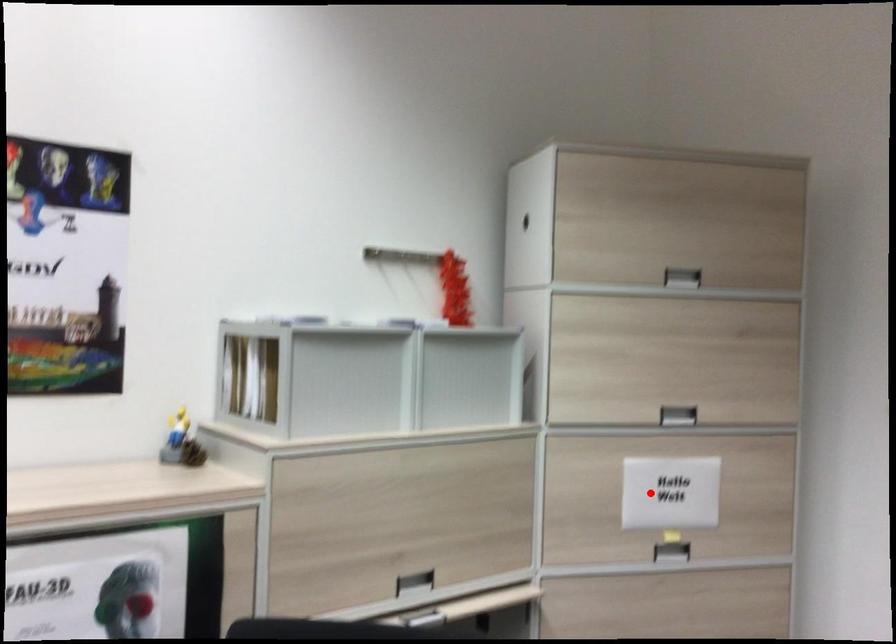
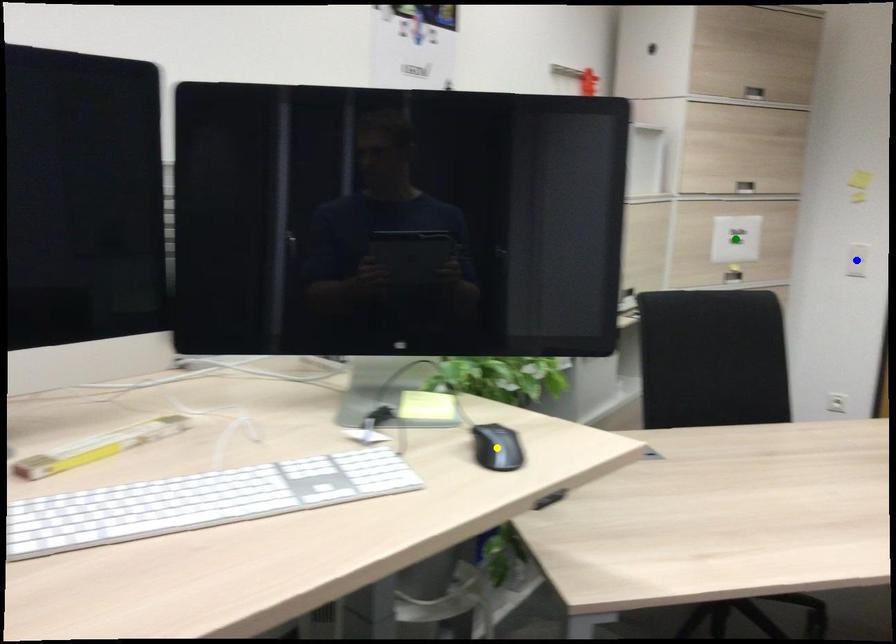
Question: I am providing you with two images of the same scene from different viewpoints. A red point is marked on the first image. You are given multiple points on the second image. Can you choose the point in image 2 that corresponds to the point in image 1?

Choices:
 (A) green point
 (B) blue point
 (C) yellow point

Answer: (A)